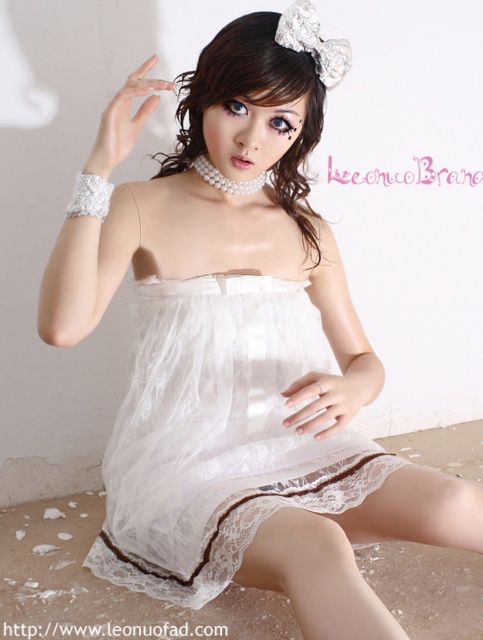
You are a photographer setting up for a photoshoot. You need to ensure that the white lace dress at center is fully visible in the frame. Given that the brown shiny hair at upper center is partially obscuring the dress, how can you adjust the subject positioning to resolve this issue?

The white lace dress at center is taller than the brown shiny hair at upper center. To ensure the dress is fully visible, the subject should lower their brown shiny hair at upper center or adjust their posture so the hair does not block the dress.